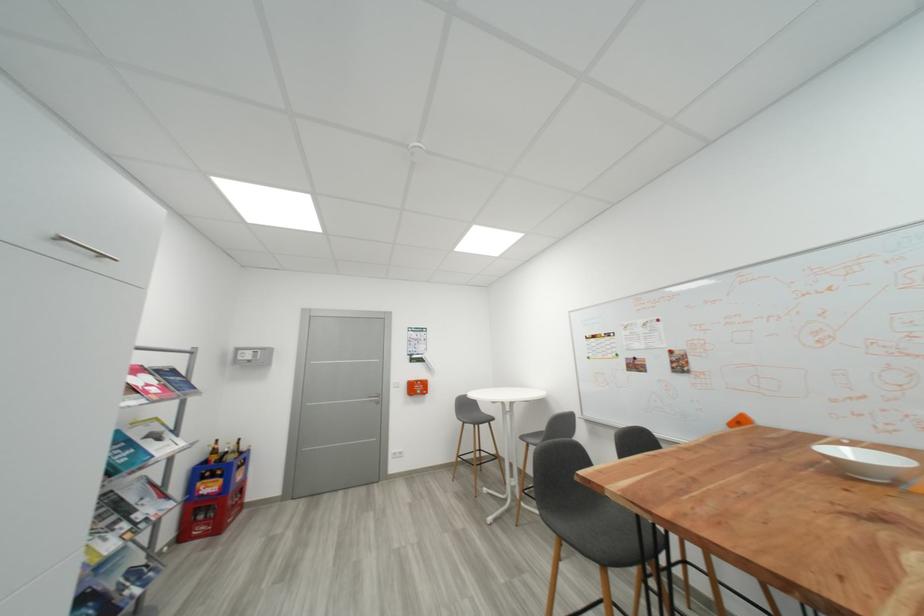
I want to click on silver door handle, so click(x=380, y=400).